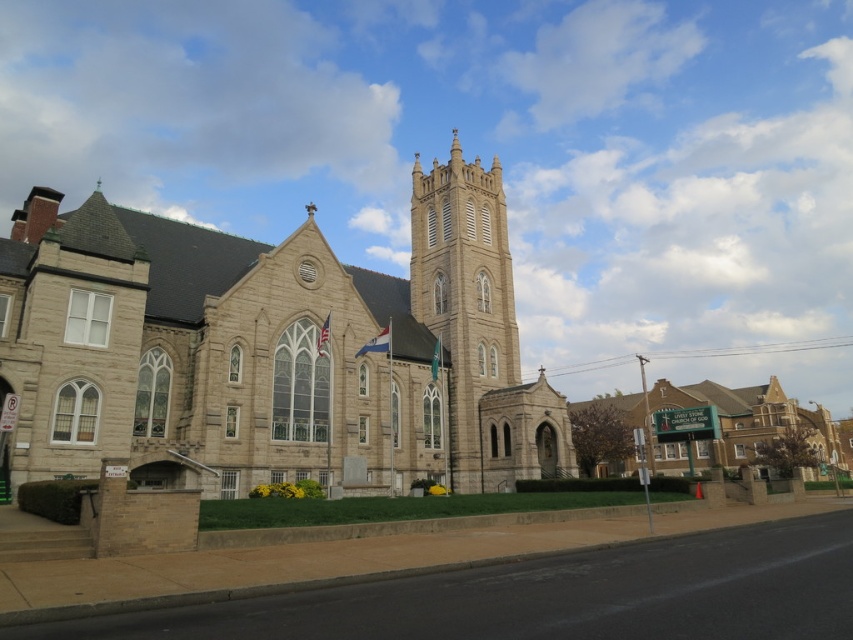
Question: Which point appears farthest from the camera in this image?

Choices:
 (A) (308, 371)
 (B) (743, 436)
 (C) (421, 173)

Answer: (B)

Question: Does beige stone church at center appear on the right side of green signboard at center?

Choices:
 (A) no
 (B) yes

Answer: (A)

Question: Which point is closer to the camera taking this photo?

Choices:
 (A) (440, 259)
 (B) (442, 353)

Answer: (B)

Question: In this image, where is beige stone church at center located relative to beige stone tower at center?

Choices:
 (A) below
 (B) above

Answer: (B)

Question: Which point is closer to the camera?

Choices:
 (A) (436, 291)
 (B) (62, 340)

Answer: (B)

Question: Does beige stone church at center have a greater width compared to green signboard at center?

Choices:
 (A) no
 (B) yes

Answer: (A)